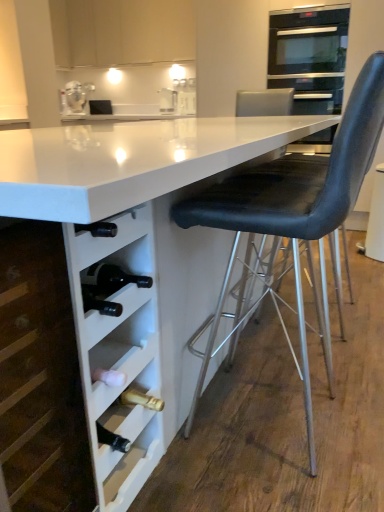
Question: Considering the relative sizes of black leather swivel chair at right and white glossy table at center in the image provided, is black leather swivel chair at right shorter than white glossy table at center?

Choices:
 (A) yes
 (B) no

Answer: (B)

Question: Is black leather swivel chair at right positioned far away from white glossy table at center?

Choices:
 (A) no
 (B) yes

Answer: (B)

Question: Is black leather swivel chair at right positioned in front of white glossy table at center?

Choices:
 (A) yes
 (B) no

Answer: (B)

Question: Are black leather swivel chair at right and white glossy table at center making contact?

Choices:
 (A) yes
 (B) no

Answer: (B)

Question: From a real-world perspective, is black leather swivel chair at right positioned over white glossy table at center based on gravity?

Choices:
 (A) yes
 (B) no

Answer: (A)

Question: From the image's perspective, is black leather swivel chair at right located beneath white glossy table at center?

Choices:
 (A) yes
 (B) no

Answer: (B)

Question: Would you consider clear glass jar at upper left to be distant from black leather swivel chair at right?

Choices:
 (A) no
 (B) yes

Answer: (B)

Question: Is clear glass jar at upper left oriented away from black leather swivel chair at right?

Choices:
 (A) yes
 (B) no

Answer: (B)

Question: Considering the relative sizes of clear glass jar at upper left and black leather swivel chair at right in the image provided, is clear glass jar at upper left taller than black leather swivel chair at right?

Choices:
 (A) no
 (B) yes

Answer: (A)

Question: Considering the relative sizes of clear glass jar at upper left and black leather swivel chair at right in the image provided, is clear glass jar at upper left shorter than black leather swivel chair at right?

Choices:
 (A) no
 (B) yes

Answer: (B)

Question: Does clear glass jar at upper left lie behind black leather swivel chair at right?

Choices:
 (A) yes
 (B) no

Answer: (A)

Question: Is black leather swivel chair at right completely or partially inside clear glass jar at upper left?

Choices:
 (A) yes
 (B) no

Answer: (B)

Question: Are black leather chair at right and clear glass jar at upper left making contact?

Choices:
 (A) no
 (B) yes

Answer: (A)